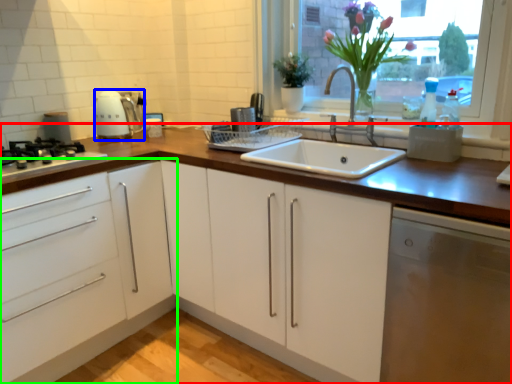
Question: Based on their relative distances, which object is nearer to countertop (highlighted by a red box)? Choose from kitchen appliance (highlighted by a blue box) and cabinetry (highlighted by a green box).

Choices:
 (A) kitchen appliance
 (B) cabinetry

Answer: (B)